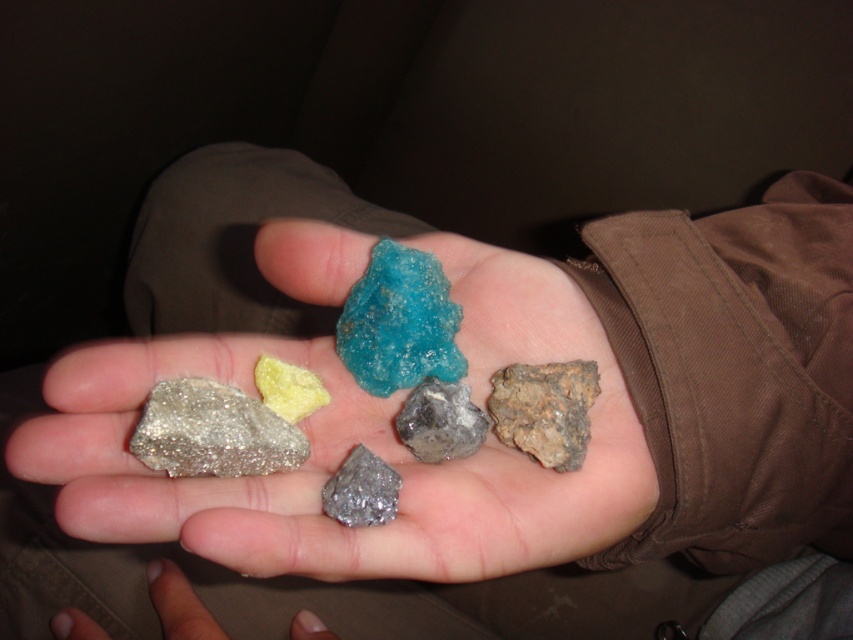
Question: Which point appears closest to the camera in this image?

Choices:
 (A) (270, 394)
 (B) (142, 532)
 (C) (370, 349)

Answer: (B)

Question: Which of the following is the closest to the observer?

Choices:
 (A) shiny metallic rocks at center
 (B) shiny metallic rock at center
 (C) slick gray rock at center
 (D) yellow crystalline mineral at center

Answer: (A)

Question: Can you confirm if shiny metallic rock at center is positioned above yellow crystalline mineral at center?

Choices:
 (A) no
 (B) yes

Answer: (A)

Question: Does matte silver rock at center appear on the right side of slick gray rock at center?

Choices:
 (A) yes
 (B) no

Answer: (B)

Question: Is shiny metallic rocks at center bigger than slick gray rock at center?

Choices:
 (A) yes
 (B) no

Answer: (A)

Question: Which of the following is the farthest from the observer?

Choices:
 (A) click(x=294, y=371)
 (B) click(x=463, y=449)
 (C) click(x=581, y=410)

Answer: (A)